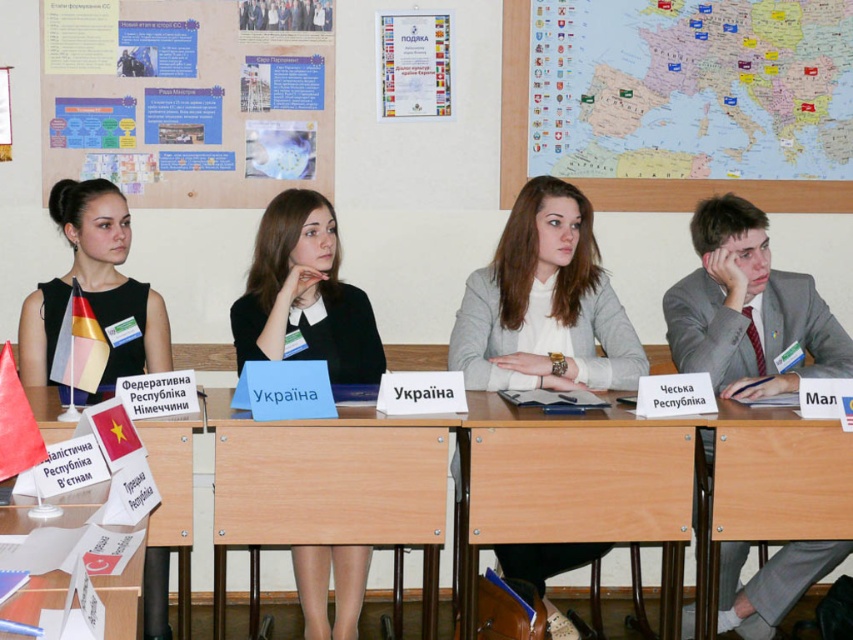
You are a photographer at the conference and need to position yourself to capture both the black matte dress at center and the black fabric dress at left in the same frame. Which direction should you move to ensure both are visible?

You should move to the left of the black fabric dress at left to include both the black matte dress at center and the black fabric dress at left in the frame since the black matte dress at center is to the right of the black fabric dress at left.

You are a photographer standing at the back of the room. You want to take a photo that includes both the point at (160, 582) and the point at (438, 17). Which point is closer to your camera?

The point at (160, 582) is closer to the camera than the point at (438, 17).

You are organizing a meeting and need to place a large document on the wooden table at center. Considering the size of the light gray sweater at center, will the document fit on the table without overlapping it?

The wooden table at center has a larger size compared to the light gray sweater at center, so the document can be placed on the wooden table at center without overlapping the light gray sweater at center.